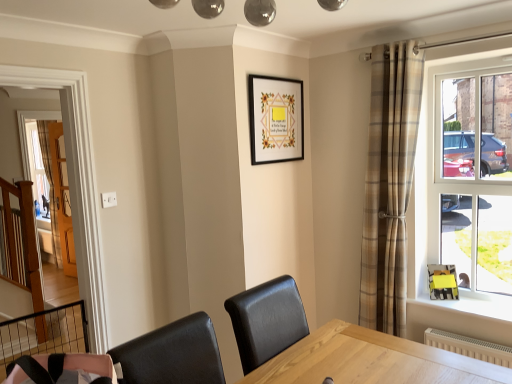
Question: Does clear glass window at right have a greater width compared to white textured radiator at lower right?

Choices:
 (A) no
 (B) yes

Answer: (A)

Question: Is clear glass window at right in front of white textured radiator at lower right?

Choices:
 (A) yes
 (B) no

Answer: (B)

Question: Is clear glass window at right facing away from white textured radiator at lower right?

Choices:
 (A) no
 (B) yes

Answer: (A)

Question: Is clear glass window at right thinner than white textured radiator at lower right?

Choices:
 (A) no
 (B) yes

Answer: (B)

Question: Does clear glass window at right have a smaller size compared to white textured radiator at lower right?

Choices:
 (A) no
 (B) yes

Answer: (A)

Question: In terms of height, does clear glass window at right look taller or shorter compared to white textured radiator at lower right?

Choices:
 (A) short
 (B) tall

Answer: (B)

Question: Does point (484, 213) appear closer or farther from the camera than point (424, 337)?

Choices:
 (A) farther
 (B) closer

Answer: (B)

Question: In terms of size, does clear glass window at right appear bigger or smaller than white textured radiator at lower right?

Choices:
 (A) small
 (B) big

Answer: (B)

Question: Considering their positions, is clear glass window at right located in front of or behind white textured radiator at lower right?

Choices:
 (A) front
 (B) behind

Answer: (B)

Question: Considering the positions of point (251, 134) and point (409, 135), is point (251, 134) closer or farther from the camera than point (409, 135)?

Choices:
 (A) farther
 (B) closer

Answer: (A)

Question: Considering the positions of black matte picture frame at upper center and plaid fabric curtain at right in the image, is black matte picture frame at upper center bigger or smaller than plaid fabric curtain at right?

Choices:
 (A) big
 (B) small

Answer: (B)

Question: In the image, is black matte picture frame at upper center positioned in front of or behind plaid fabric curtain at right?

Choices:
 (A) behind
 (B) front

Answer: (A)

Question: From the image's perspective, relative to plaid fabric curtain at right, is black matte picture frame at upper center above or below?

Choices:
 (A) below
 (B) above

Answer: (B)

Question: From a real-world perspective, is clear glass window at right physically located above or below black matte picture frame at upper center?

Choices:
 (A) below
 (B) above

Answer: (A)

Question: Looking at the image, does clear glass window at right seem bigger or smaller compared to black matte picture frame at upper center?

Choices:
 (A) big
 (B) small

Answer: (A)